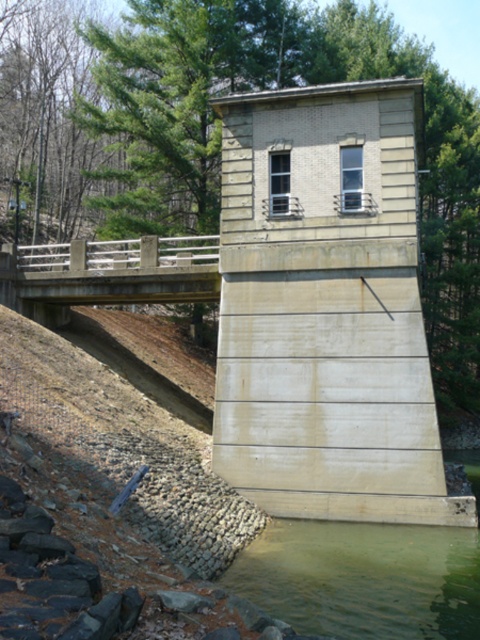
You are a construction inspector evaluating the structural integrity of the dam. You notice the greenish concrete water at lower center and the concrete bridge at center. Which of these two elements has a narrower width?

The greenish concrete water at lower center is thinner than the concrete bridge at center, so the greenish concrete water at lower center has a narrower width.

You are standing on the concrete bridge at center and want to reach the greenish concrete water at lower center. Which direction should you move to get there?

You should move to the right side of the concrete bridge at center to reach the greenish concrete water at lower center because it is positioned on the right side of concrete bridge at center.

You are standing at the edge of the greenish concrete water at lower center and want to reach the concrete bridge at center. Which direction should you move to get closer to the bridge?

You should move upward because the greenish concrete water at lower center is shorter than the concrete bridge at center, meaning the bridge is higher in elevation.